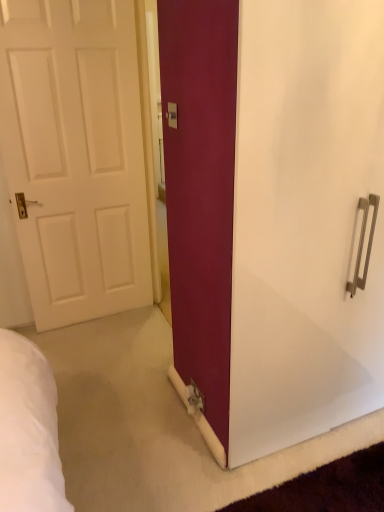
Question: From a real-world perspective, relative to matte white screen door at center, is white matte door at left vertically above or below?

Choices:
 (A) above
 (B) below

Answer: (A)

Question: Based on their sizes in the image, would you say white matte door at left is bigger or smaller than matte white screen door at center?

Choices:
 (A) small
 (B) big

Answer: (A)

Question: Estimate the real-world distances between objects in this image. Which object is closer to the matte white electric outlet at center?

Choices:
 (A) matte white screen door at center
 (B) white matte door at left

Answer: (A)

Question: Estimate the real-world distances between objects in this image. Which object is farther from the matte white screen door at center?

Choices:
 (A) matte white electric outlet at center
 (B) white matte door at left

Answer: (B)